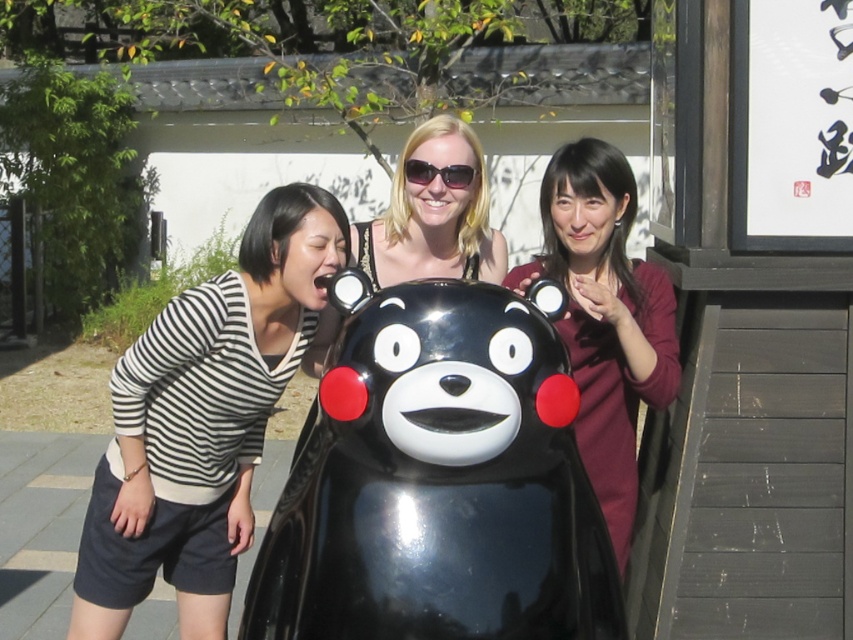
Can you confirm if glossy black bear at center is bigger than striped fabric shirt at left?

Actually, glossy black bear at center might be smaller than striped fabric shirt at left.

Does glossy black bear at center have a smaller size compared to striped fabric shirt at left?

Indeed, glossy black bear at center has a smaller size compared to striped fabric shirt at left.

Between point (450, 563) and point (183, 579), which one is positioned behind?

The point (183, 579) is behind.

This screenshot has width=853, height=640. I want to click on glossy black bear at center, so click(438, 481).

Can you confirm if glossy black bear at center is positioned to the left of maroon sweater at right?

Indeed, glossy black bear at center is positioned on the left side of maroon sweater at right.

Between glossy black bear at center and maroon sweater at right, which one has more height?

maroon sweater at right

Does point (474, 387) come closer to viewer compared to point (634, 499)?

Yes, point (474, 387) is closer to viewer.

You are a GUI agent. You are given a task and a screenshot of the screen. Output one action in this format:
    pyautogui.click(x=<x>, y=<y>)
    Task: Click on the glossy black bear at center
    The width and height of the screenshot is (853, 640).
    Given the screenshot: What is the action you would take?
    pyautogui.click(x=438, y=481)

Image resolution: width=853 pixels, height=640 pixels. Describe the element at coordinates (202, 420) in the screenshot. I see `striped fabric shirt at left` at that location.

Is point (128, 403) positioned before point (624, 253)?

Yes, point (128, 403) is closer to viewer.

Identify the location of striped fabric shirt at left. (202, 420).